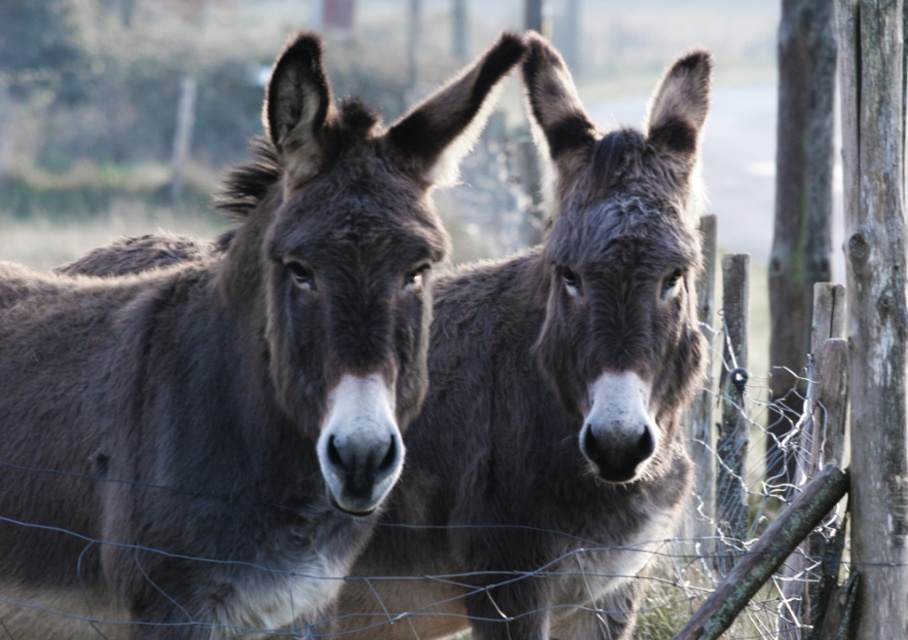
You are a farmer trying to identify the position of the donkeys in your field. You see a dark brown fur mule at center and a dark gray fur at center. Which donkey is positioned to the left?

The dark brown fur mule at center is to the left of dark gray fur at center, so the dark brown fur mule at center is positioned to the left.

You are a photographer trying to capture both the dark brown fur mule at center and the dark gray fur at center in a single frame. Given that your camera has a minimum focus distance of 20 inches, will you be able to focus on both subjects simultaneously?

The distance between the dark brown fur mule at center and the dark gray fur at center is 19.82 inches. Since this distance is less than the camera minimum focus distance of 20 inches, the camera cannot focus on both subjects simultaneously.

You are a photographer standing in front of the two donkeys. You notice two specific points marked in the image. The first point is at coordinates point (53, 467) and the second is at point (568, 330). Which of these points is closer to you?

Point (53, 467) is in front of point (568, 330), so it is closer to you.